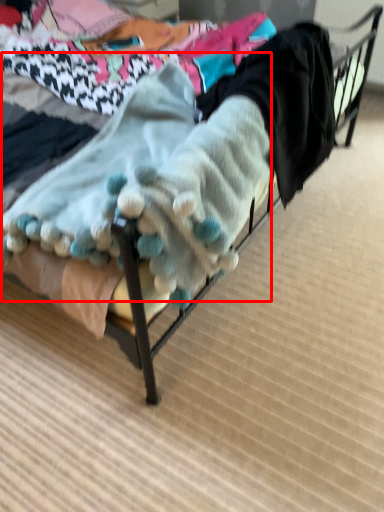
Question: From the image's perspective, considering the relative positions of baby clothe (annotated by the red box) and clothing in the image provided, where is baby clothe (annotated by the red box) located with respect to the staircase?

Choices:
 (A) above
 (B) below

Answer: (B)